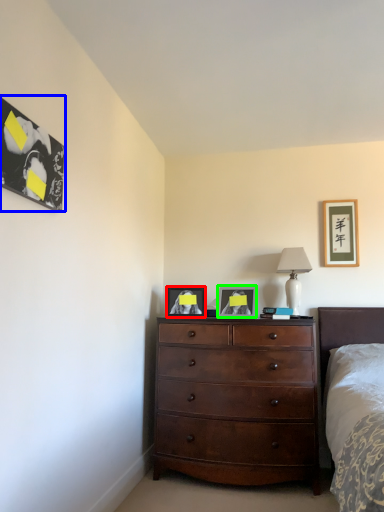
Question: Which is farther away from picture frame (highlighted by a red box)? picture frame (highlighted by a blue box) or picture frame (highlighted by a green box)?

Choices:
 (A) picture frame
 (B) picture frame

Answer: (A)